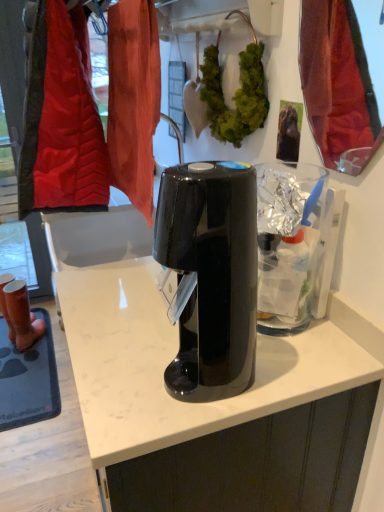
Question: In the image, is matte brown boots at left positioned in front of or behind green leafy plant at center?

Choices:
 (A) front
 (B) behind

Answer: (B)

Question: In terms of size, does matte brown boots at left appear bigger or smaller than green leafy plant at center?

Choices:
 (A) big
 (B) small

Answer: (A)

Question: Which object is positioned farthest from the matte brown boots at left?

Choices:
 (A) black glossy coffee maker at center
 (B) green leafy plant at center
 (C) shiny red fabric at upper right

Answer: (A)

Question: Which object is the farthest from the green leafy plant at center?

Choices:
 (A) matte brown boots at left
 (B) shiny red fabric at upper right
 (C) black glossy coffee maker at center

Answer: (A)